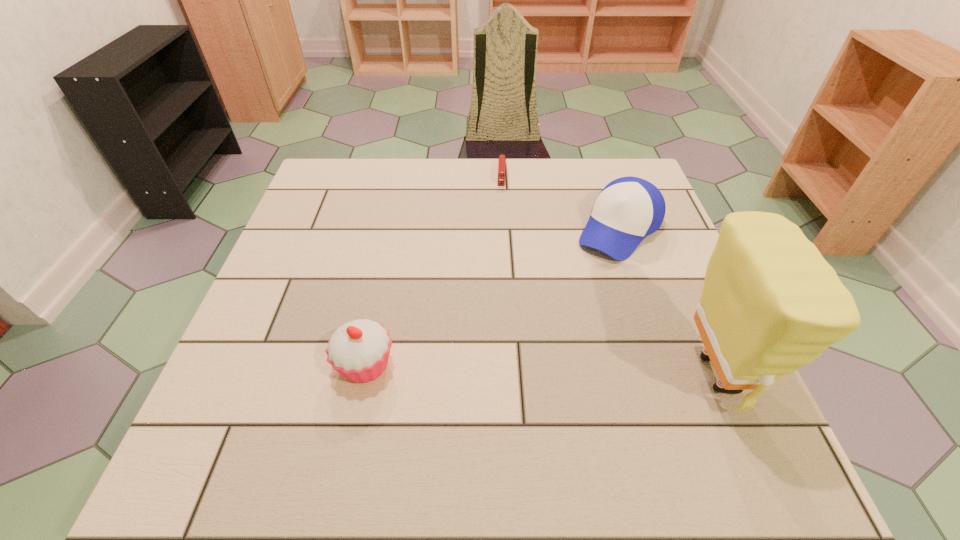
I want to click on free spot at the far edge of the desktop, so click(x=541, y=207).

You are a GUI agent. You are given a task and a screenshot of the screen. Output one action in this format:
    pyautogui.click(x=<x>, y=<y>)
    Task: Click on the vacant region at the near edge of the desktop
    
    Given the screenshot: What is the action you would take?
    pyautogui.click(x=560, y=389)

You are a GUI agent. You are given a task and a screenshot of the screen. Output one action in this format:
    pyautogui.click(x=<x>, y=<y>)
    Task: Click on the vacant space at the left edge of the desktop
    
    Given the screenshot: What is the action you would take?
    pyautogui.click(x=320, y=327)

I want to click on free space at the right edge of the desktop, so click(x=626, y=272).

Where is `free space at the far left corner of the desktop`? This screenshot has height=540, width=960. free space at the far left corner of the desktop is located at coordinates (335, 170).

This screenshot has width=960, height=540. I want to click on free space at the near left corner of the desktop, so click(x=306, y=389).

The image size is (960, 540). In order to click on vacant region at the near right corner in this screenshot , I will do `click(665, 420)`.

This screenshot has width=960, height=540. In order to click on empty space between the third nearest object and the leftmost object in this screenshot , I will do `click(492, 298)`.

The height and width of the screenshot is (540, 960). I want to click on vacant space that is in between the farthest object and the third nearest object, so tap(561, 202).

Where is `empty space between the cupcake and the sponge`? The width and height of the screenshot is (960, 540). empty space between the cupcake and the sponge is located at coordinates (540, 370).